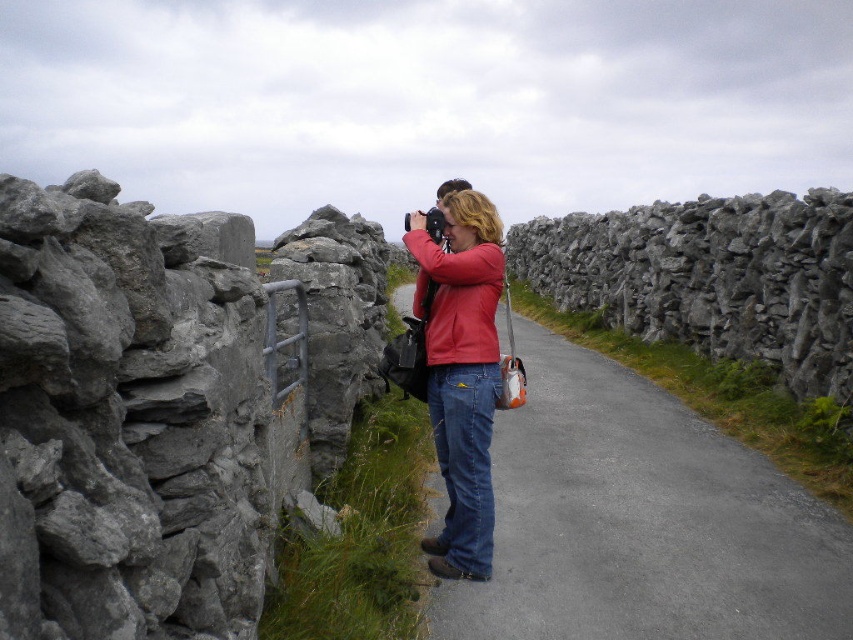
Does gray asphalt road at center appear on the left side of gray rough stone wall at right?

Correct, you'll find gray asphalt road at center to the left of gray rough stone wall at right.

Is point (512, 433) behind point (831, 381)?

That is True.

Locate an element on the screen. gray asphalt road at center is located at coordinates (641, 522).

Image resolution: width=853 pixels, height=640 pixels. What do you see at coordinates (160, 406) in the screenshot?
I see `gray rough stone at left` at bounding box center [160, 406].

Is gray rough stone at left wider than gray asphalt road at center?

No.

Image resolution: width=853 pixels, height=640 pixels. Describe the element at coordinates (160, 406) in the screenshot. I see `gray rough stone at left` at that location.

I want to click on gray rough stone at left, so click(160, 406).

Which is behind, point (372, 236) or point (512, 237)?

Positioned behind is point (512, 237).

Between point (113, 284) and point (636, 268), which one is positioned in front?

Positioned in front is point (113, 284).

Where is `gray rough stone at left`? gray rough stone at left is located at coordinates (160, 406).